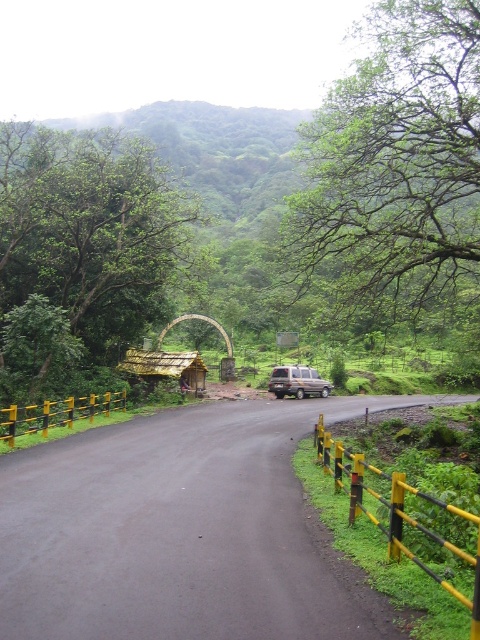
Question: Which object is positioned farthest from the metallic silver van at center?

Choices:
 (A) green leafy tree at center
 (B) green leafy tree at upper center

Answer: (A)

Question: Estimate the real-world distances between objects in this image. Which object is farther from the metallic silver van at center?

Choices:
 (A) green leafy tree at upper center
 (B) green leafy tree at center

Answer: (B)

Question: Which object is closer to the camera taking this photo?

Choices:
 (A) green leafy tree at upper center
 (B) green leafy tree at center

Answer: (A)

Question: Does green leafy tree at upper center have a larger size compared to green leafy tree at center?

Choices:
 (A) no
 (B) yes

Answer: (B)

Question: Does green leafy tree at upper center appear over green leafy tree at center?

Choices:
 (A) yes
 (B) no

Answer: (A)

Question: Does green leafy tree at upper center lie behind metallic silver van at center?

Choices:
 (A) yes
 (B) no

Answer: (B)